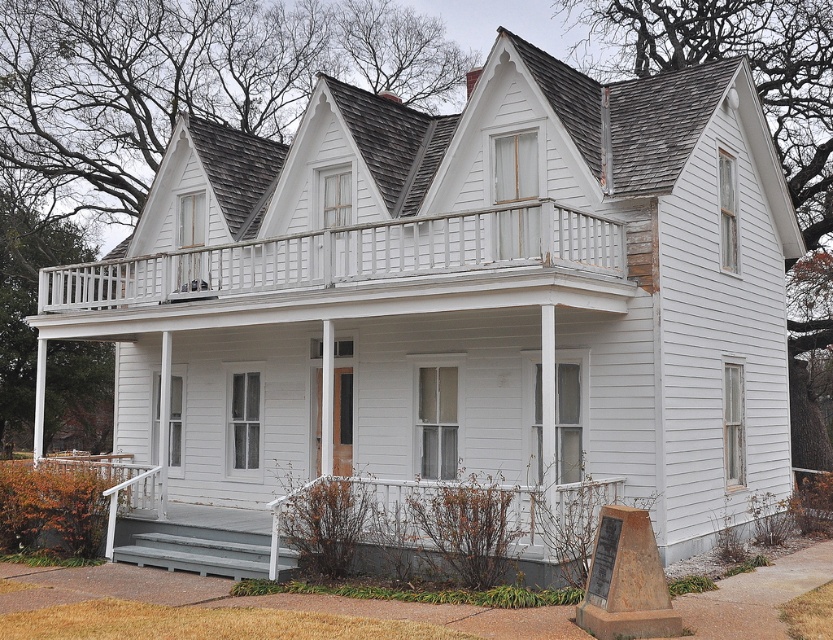
You are standing in front of the house and want to take a photo of the white wooden porch at upper center. If your camera can focus on objects up to 10 meters away, will it be able to capture the porch clearly?

The white wooden porch at upper center is 11.19 meters away from the camera, which exceeds the 10 meters focus range. Therefore, the camera may not capture the porch clearly.

You are standing at the brown stone marker at lower right and want to enter the house through the front door. Which direction should you look to see the white wooden porch at upper center?

The white wooden porch at upper center is above the brown stone marker at lower right, so you should look upward to see it.

You are standing in front of the house and want to place a new flower pot between the white wooden porch at upper center and the brown stone marker at lower right. Which side of the flower pot should face the house?

The flower pot should be placed so that its side facing the house is between the white wooden porch at upper center and the brown stone marker at lower right, with the white wooden porch at upper center positioned to the left of the brown stone marker at lower right.